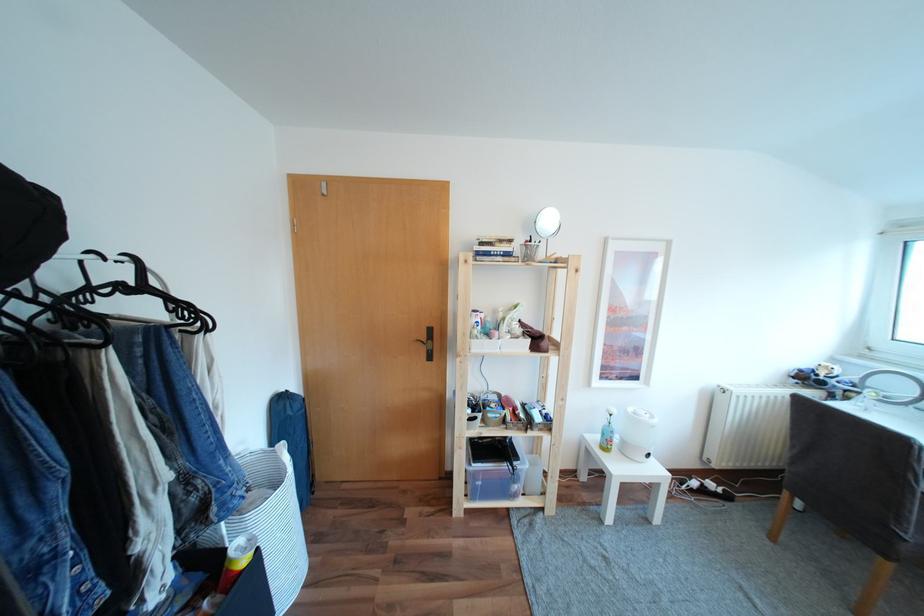
Describe the element at coordinates (424, 342) in the screenshot. I see `a black door handle` at that location.